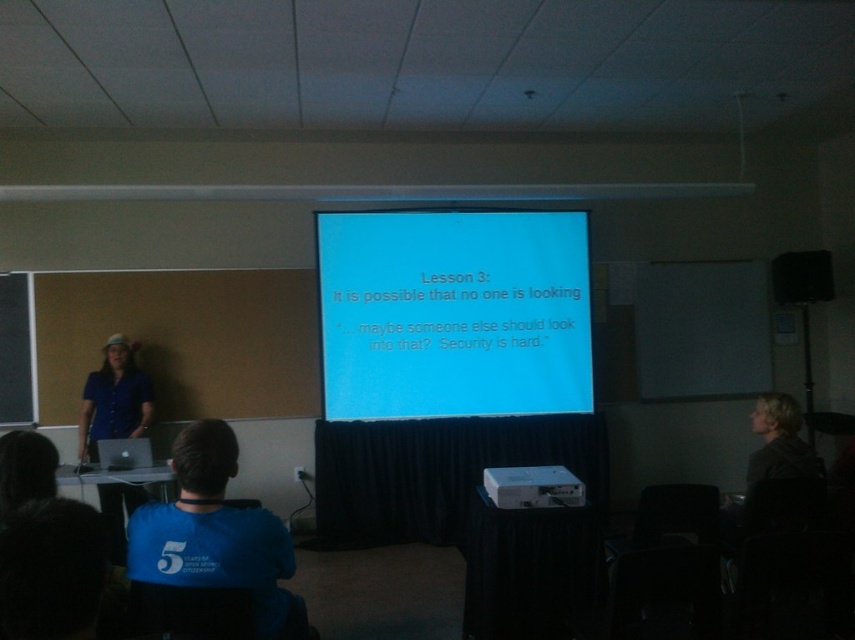
You are a student in the classroom and want to know which object is bigger between the blue fabric shirt at left and the matte black speaker at upper right. Can you determine this without measuring?

The blue fabric shirt at left is larger in size than the matte black speaker at upper right according to the description.

You are a student sitting at the back of the classroom. You need to hand a note to the presenter. The presenter is wearing a blue fabric shirt at left. There is also a blue fabric shirt at lower center in the room. Which blue fabric shirt is closer to you?

The blue fabric shirt at lower center is 2.97 meters away from the blue fabric shirt at left. Since you are at the back of the classroom, the presenter at the blue fabric shirt at left is closer to you than the blue fabric shirt at lower center.

From the picture: You are a student sitting in the classroom and want to ask a question to the presenter wearing the blue fabric shirt at lower center. Where should you look to find them?

The presenter wearing the blue fabric shirt at lower center is located at the 2D coordinates point (210, 552), so you should look in that direction to find them.